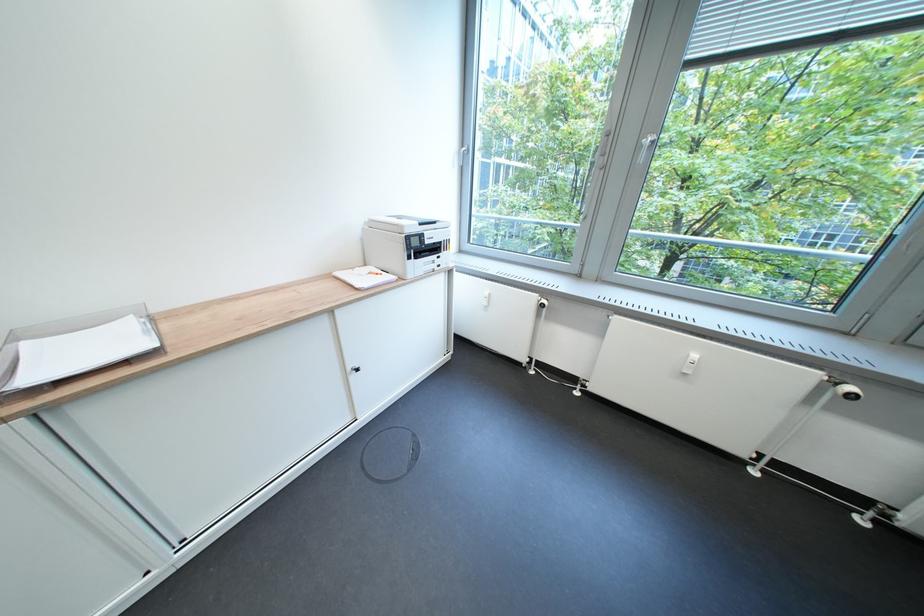
Where would you pull the window handle? Please return your answer as a coordinate pair (x, y).

(645, 148)